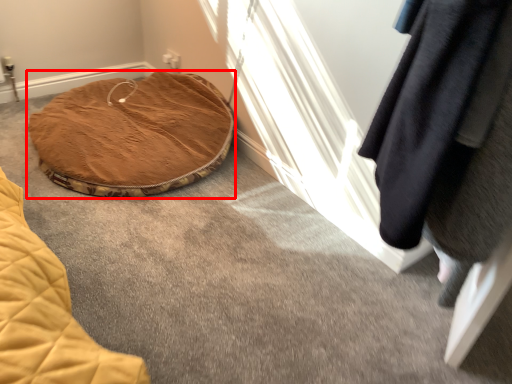
Question: From the image's perspective, where is furniture (annotated by the red box) located in relation to clothing in the image?

Choices:
 (A) below
 (B) above

Answer: (B)